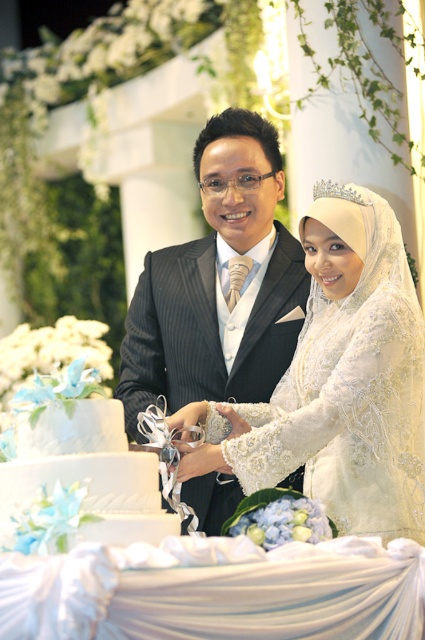
You are a photographer at the wedding. You need to capture a photo of the white lace dress at center and the matte black suit at center. Which one of the two should you focus on first if you want to highlight the smaller object?

You should focus on the white lace dress at center first because it is smaller than the matte black suit at center.